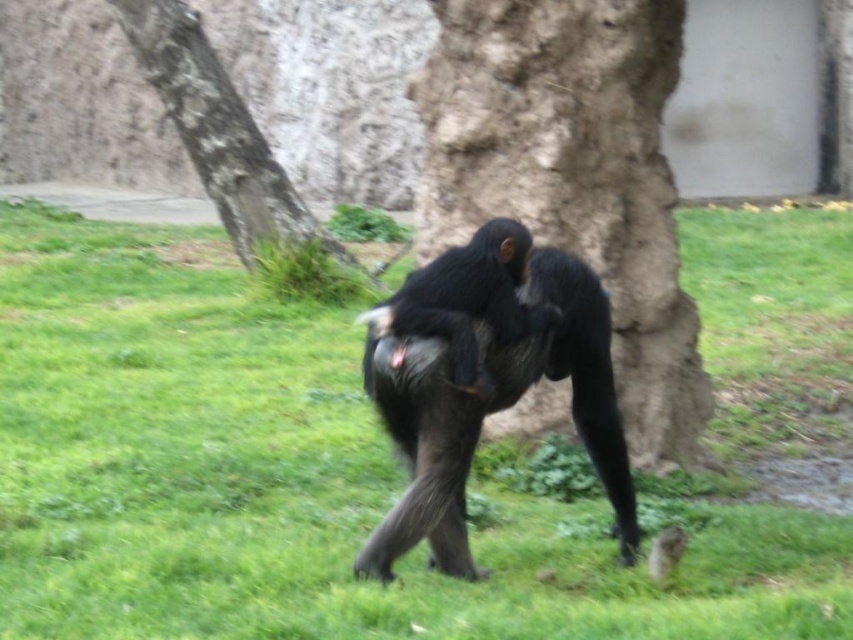
You are a zookeeper who needs to place a feeding tray between the rough bark tree trunk at center and the shiny black monkey at center. Since the tray requires a space wider than the monkey, will the available space between them suffice?

The rough bark tree trunk at center is wider than the shiny black monkey at center, so the space between them is sufficient to place the feeding tray as the tree trunk provides enough width.

You are a zookeeper who needs to place a new feeding tray between the green grassy at center and the rough bark tree trunk at center. Based on their positions, which object should the feeding tray be closer to?

The feeding tray should be placed closer to the rough bark tree trunk at center because the green grassy at center is located to the left of it, so the tray should be positioned between them with the tree trunk being the right side reference.

You are a zookeeper standing in the enclosure with the chimpanzees. You need to retrieve a fallen apple that rolled under the rough bark tree trunk at center. Considering your height and the distance, can you safely reach the apple without climbing?

The rough bark tree trunk at center is 4.72 meters away from the viewer. Since the distance is quite far, it might be challenging to reach the apple without assistance or tools. Climbing is not recommended in the enclosure for safety reasons, so you should use a long pole or ask for help to retrieve the apple safely.